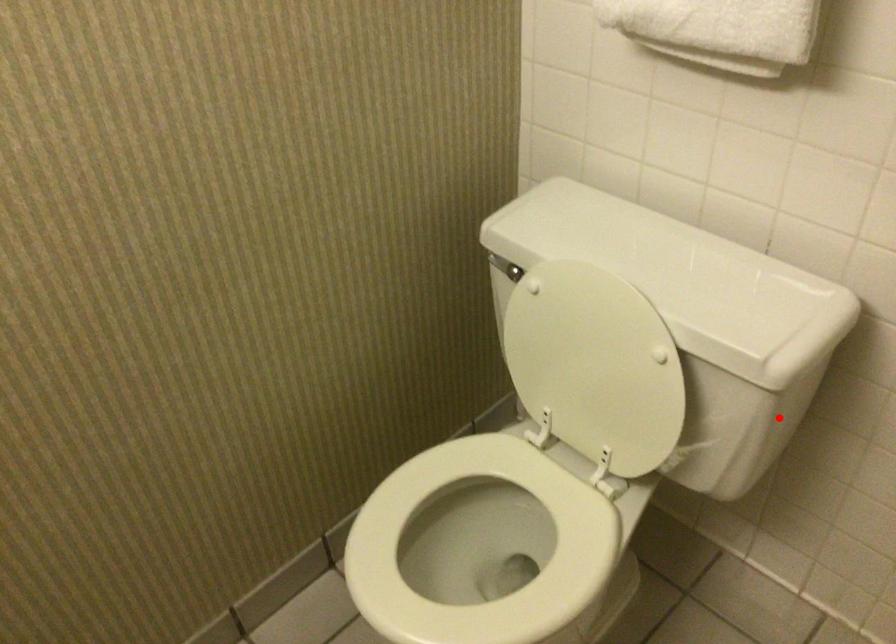
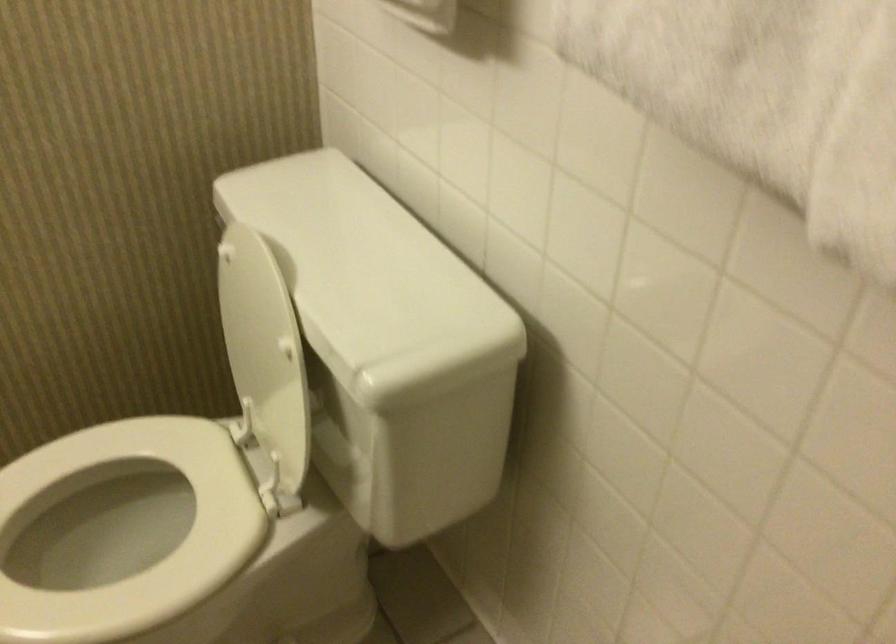
Question: I am providing you with two images of the same scene from different viewpoints. Given a red point in image1, look at the same physical point in image2. Is it:

Choices:
 (A) Closer to the viewpoint
 (B) Farther from the viewpoint

Answer: (A)